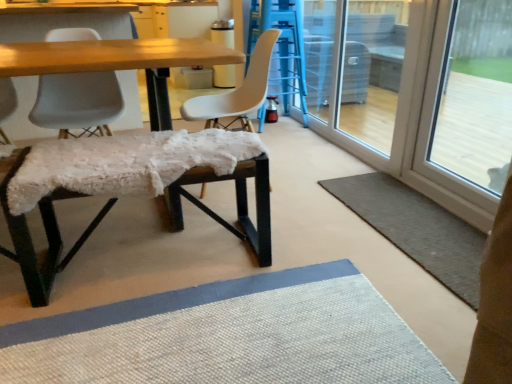
Question: From their relative heights in the image, would you say matte blue bar stool at center, which appears as the 2th bar stool when viewed from the left, is taller or shorter than wooden table at center?

Choices:
 (A) short
 (B) tall

Answer: (B)

Question: From a real-world perspective, is matte blue bar stool at center, the second bar stool positioned from the bottom, physically located above or below wooden table at center?

Choices:
 (A) below
 (B) above

Answer: (B)

Question: Which object is the farthest from the matte blue bar stool at center, which appears as the 2th bar stool when viewed from the left?

Choices:
 (A) transparent glass screen door at right
 (B) transparent glass door at right
 (C) gray textured rug at lower right
 (D) fuzzy fabric bench at center, positioned as the 2th bar stool in top-to-bottom order
 (E) white matte chair at center, which is counted as the second chair, starting from the left

Answer: (D)

Question: Considering the real-world distances, which object is closest to the white matte chair at center, which is the 1th chair in right-to-left order?

Choices:
 (A) matte blue bar stool at center, the second bar stool positioned from the bottom
 (B) wooden table at center
 (C) white textured bench at lower left, the second chair in the right-to-left sequence
 (D) fuzzy fabric bench at center, positioned as the 2th bar stool in top-to-bottom order
 (E) transparent glass screen door at right

Answer: (B)